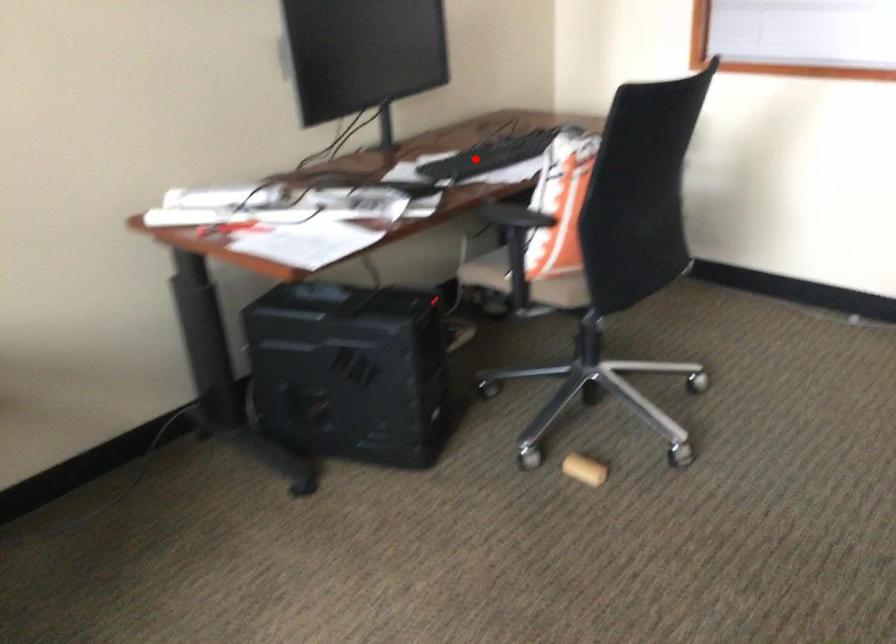
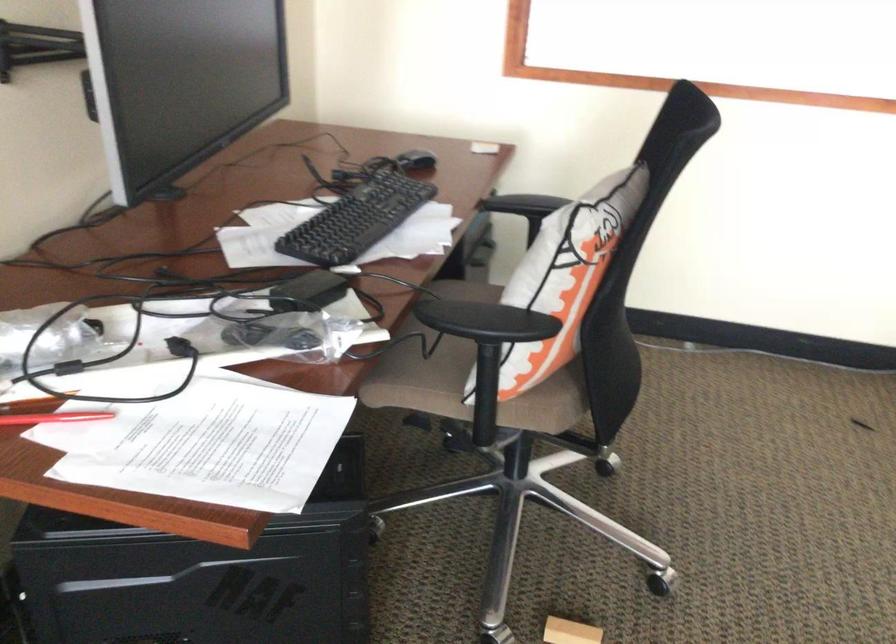
The point at the highlighted location is marked in the first image. Where is the corresponding point in the second image?

(356, 220)